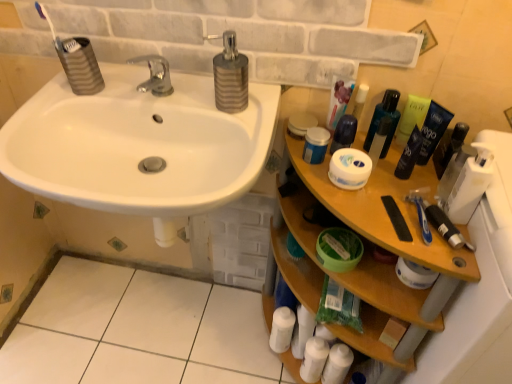
The width and height of the screenshot is (512, 384). Identify the location of vacant area that lies between blue plastic toothbrush at right, the 2th toothbrush positioned from the top, and white matte jar at upper right, which appears as the second mouthwash when viewed from the left. pyautogui.click(x=395, y=198).